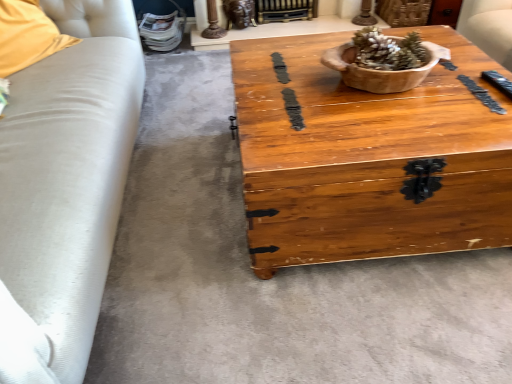
Question: From the image's perspective, is wooden chest at center located above or below gold metallic fireplace at upper center?

Choices:
 (A) below
 (B) above

Answer: (A)

Question: Is wooden chest at center in front of or behind gold metallic fireplace at upper center in the image?

Choices:
 (A) front
 (B) behind

Answer: (A)

Question: Which is nearer to the soft yellow fabric pillow at left?

Choices:
 (A) gold metallic fireplace at upper center
 (B) wooden bowl at center
 (C) wooden chest at center

Answer: (C)

Question: Which object is the farthest from the wooden bowl at center?

Choices:
 (A) wooden chest at center
 (B) soft yellow fabric pillow at left
 (C) gold metallic fireplace at upper center

Answer: (C)